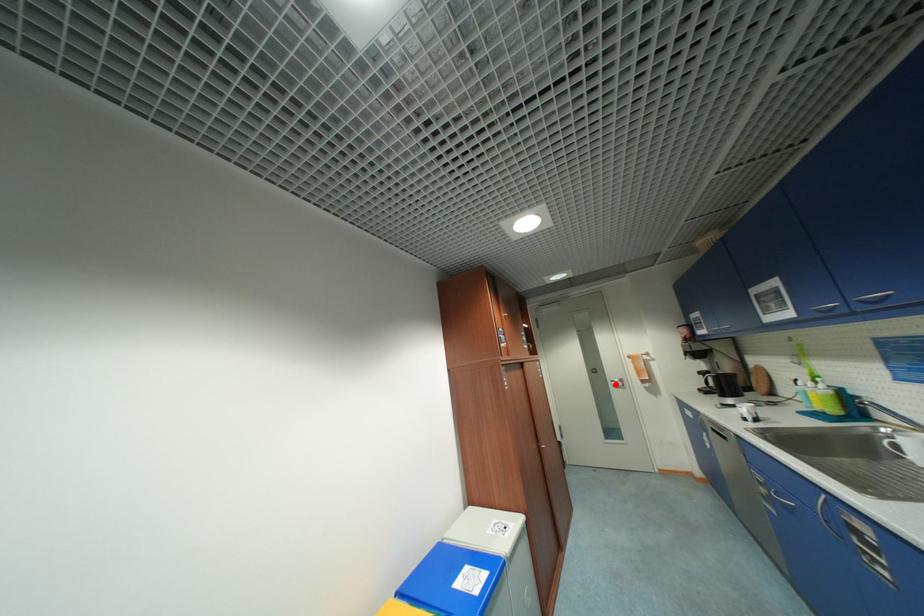
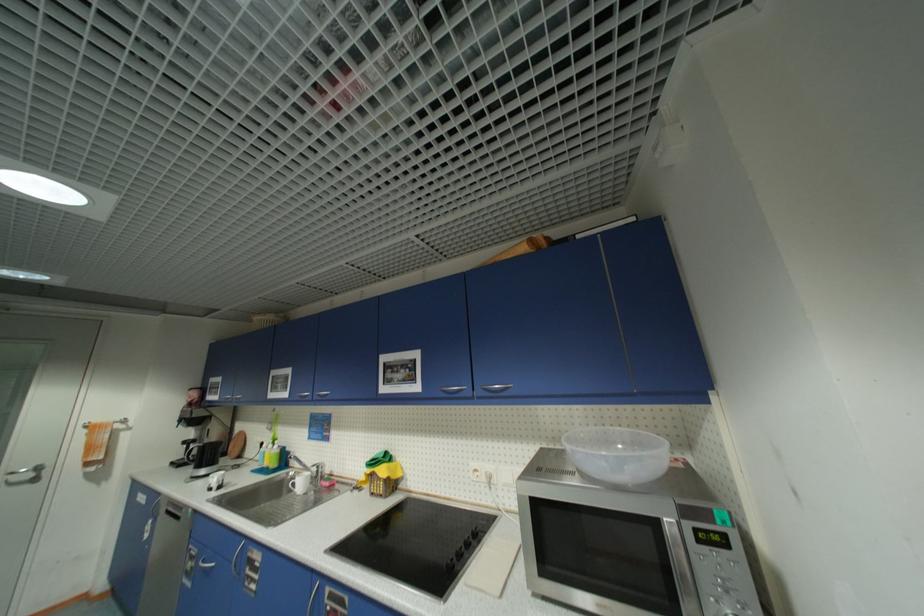
Question: I am providing you with two images of the same scene from different viewpoints. Given a red point in image1, look at the same physical point in image2. Is it:

Choices:
 (A) Closer to the viewpoint
 (B) Farther from the viewpoint

Answer: (A)